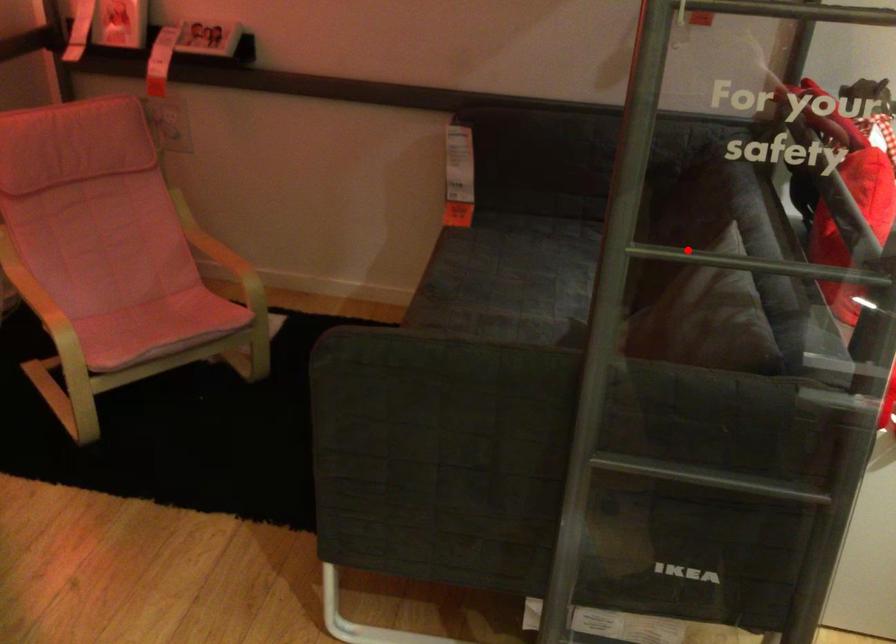
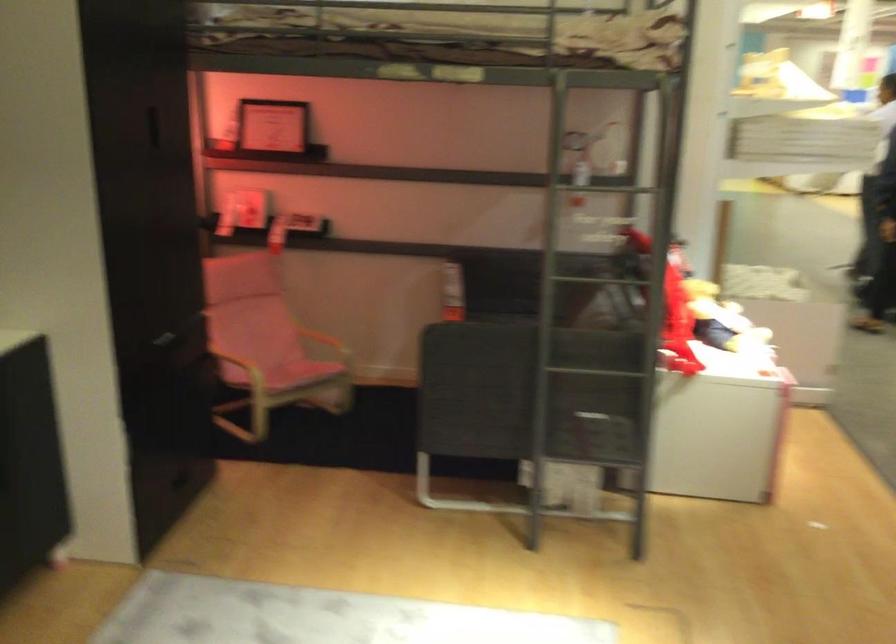
Question: I am providing you with two images of the same scene from different viewpoints. Given a red point in image1, look at the same physical point in image2. Is it:

Choices:
 (A) Closer to the viewpoint
 (B) Farther from the viewpoint

Answer: (B)